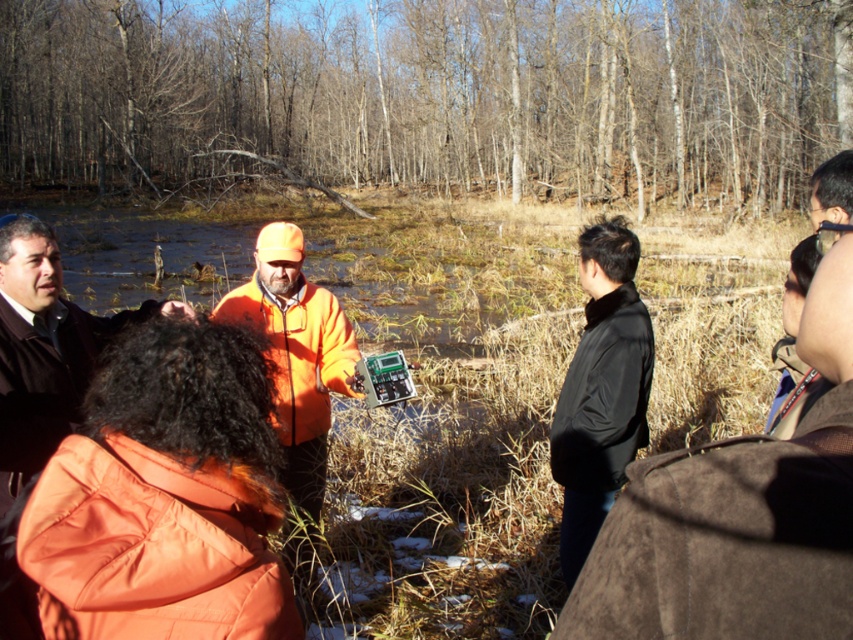
Question: Is black smooth jacket at center positioned behind orange matte jacket at center?

Choices:
 (A) no
 (B) yes

Answer: (B)

Question: Can you confirm if orange puffy jacket at lower left is positioned above black smooth jacket at center?

Choices:
 (A) no
 (B) yes

Answer: (A)

Question: Does orange puffy jacket at lower left have a greater width compared to black smooth jacket at center?

Choices:
 (A) no
 (B) yes

Answer: (B)

Question: Based on their relative distances, which object is farther from the orange puffy jacket at lower left?

Choices:
 (A) black suede jacket at upper right
 (B) smooth bark tree at center
 (C) brown leather jacket at upper right
 (D) orange matte jacket at center

Answer: (B)

Question: Based on their relative distances, which object is farther from the orange puffy jacket at lower left?

Choices:
 (A) brown leather jacket at upper right
 (B) orange matte jacket at center
 (C) black suede jacket at upper right

Answer: (A)

Question: Which object is closer to the camera taking this photo?

Choices:
 (A) smooth bark tree at center
 (B) orange puffy jacket at lower left
 (C) orange matte jacket at center

Answer: (B)